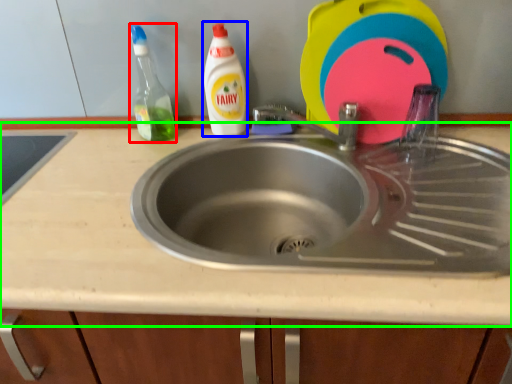
Question: Which is nearer to the cleaning product (highlighted by a red box)? cleaning product (highlighted by a blue box) or countertop (highlighted by a green box).

Choices:
 (A) cleaning product
 (B) countertop

Answer: (A)